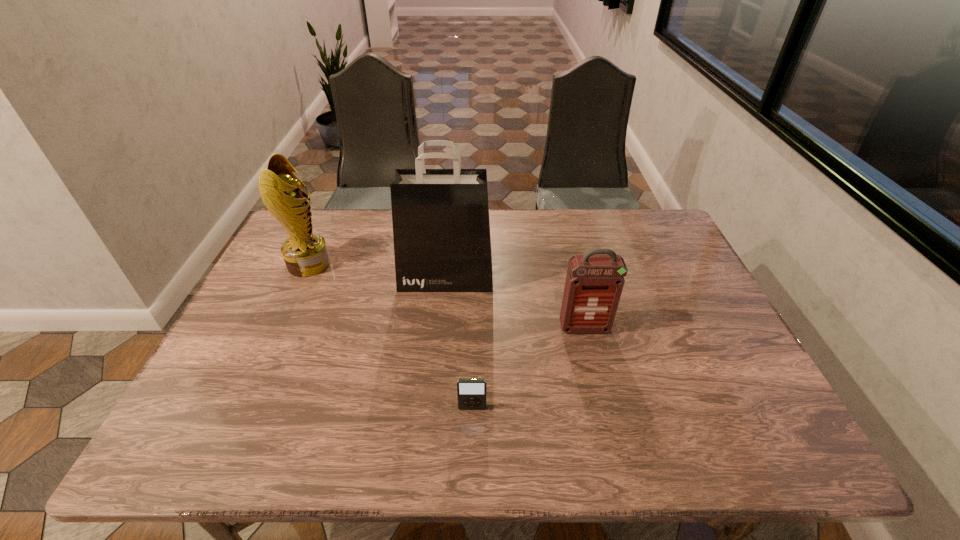
Where is `free space located 0.060m on the front-facing side of the shortest object`? Image resolution: width=960 pixels, height=540 pixels. free space located 0.060m on the front-facing side of the shortest object is located at coordinates (471, 437).

I want to click on object present at the far edge, so click(305, 253).

This screenshot has height=540, width=960. Identify the location of object at the left edge. (305, 253).

This screenshot has height=540, width=960. I want to click on object at the far left corner, so click(305, 253).

You are a GUI agent. You are given a task and a screenshot of the screen. Output one action in this format:
    pyautogui.click(x=<x>, y=<y>)
    Task: Click on the vacant space at the far edge of the desktop
    This screenshot has height=540, width=960.
    Given the screenshot: What is the action you would take?
    pyautogui.click(x=580, y=239)

Locate an element on the screen. vacant region at the near edge is located at coordinates (324, 460).

This screenshot has width=960, height=540. In the image, there is a desktop. What are the coordinates of `free space at the left edge` in the screenshot? It's located at (215, 415).

You are a GUI agent. You are given a task and a screenshot of the screen. Output one action in this format:
    pyautogui.click(x=<x>, y=<y>)
    Task: Click on the free space at the right edge of the desktop
    This screenshot has width=960, height=540.
    Given the screenshot: What is the action you would take?
    pyautogui.click(x=637, y=264)

Image resolution: width=960 pixels, height=540 pixels. Identify the location of vacant position at the far left corner of the desktop. (315, 209).

You are a GUI agent. You are given a task and a screenshot of the screen. Output one action in this format:
    pyautogui.click(x=<x>, y=<y>)
    Task: Click on the empty space that is in between the shopping bag and the iPod
    This screenshot has width=960, height=540.
    Given the screenshot: What is the action you would take?
    pyautogui.click(x=459, y=343)